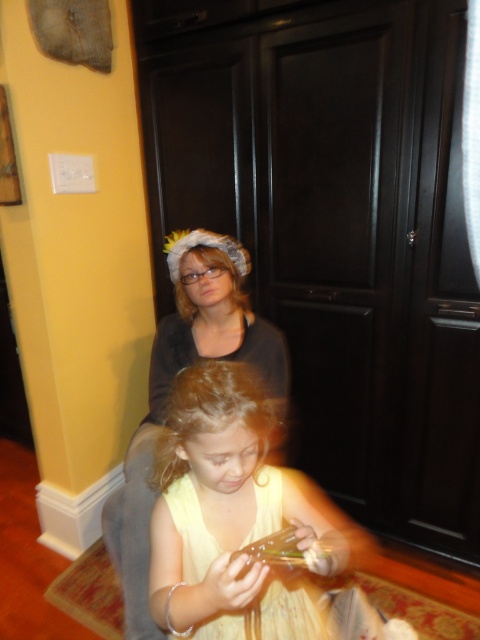
Please provide the 2D coordinates of the yellow fabric dress at center in the image coordinate system where the origin is at the bottom left corner of the image. The coordinates should be in the format of a tuple with two decimal numbers separated by a comma.

The 2D coordinates of the yellow fabric dress at center are at point (x=245, y=525).

You are a photographer setting up a shoot in this room. You need to position a spotlight so it illuminates both the matte black shirt at upper center and the blonde curly hair at center. Based on their positions, which object should the spotlight be angled higher to reach?

The spotlight should be angled higher to reach the matte black shirt at upper center because it is much taller than the blonde curly hair at center.